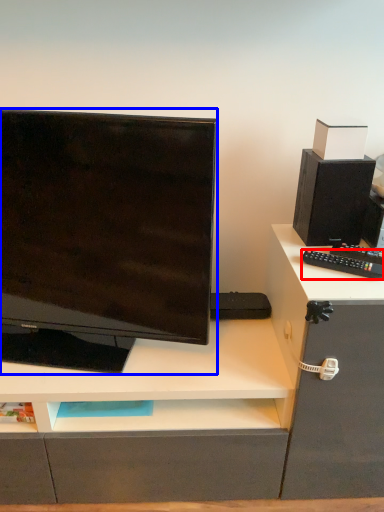
Question: Which of the following is the farthest to the observer, remote control (highlighted by a red box) or computer monitor (highlighted by a blue box)?

Choices:
 (A) remote control
 (B) computer monitor

Answer: (A)